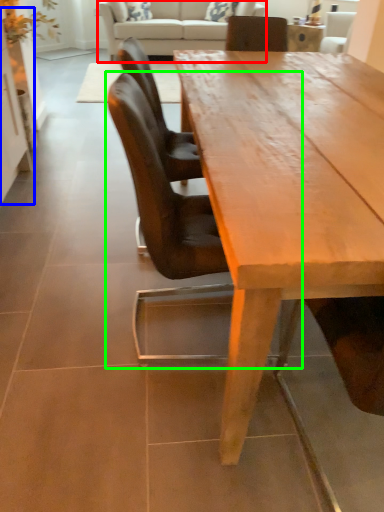
Question: Which object is the closest to the studio couch (highlighted by a red box)? Choose among these: cabinetry (highlighted by a blue box) or chair (highlighted by a green box).

Choices:
 (A) cabinetry
 (B) chair

Answer: (A)